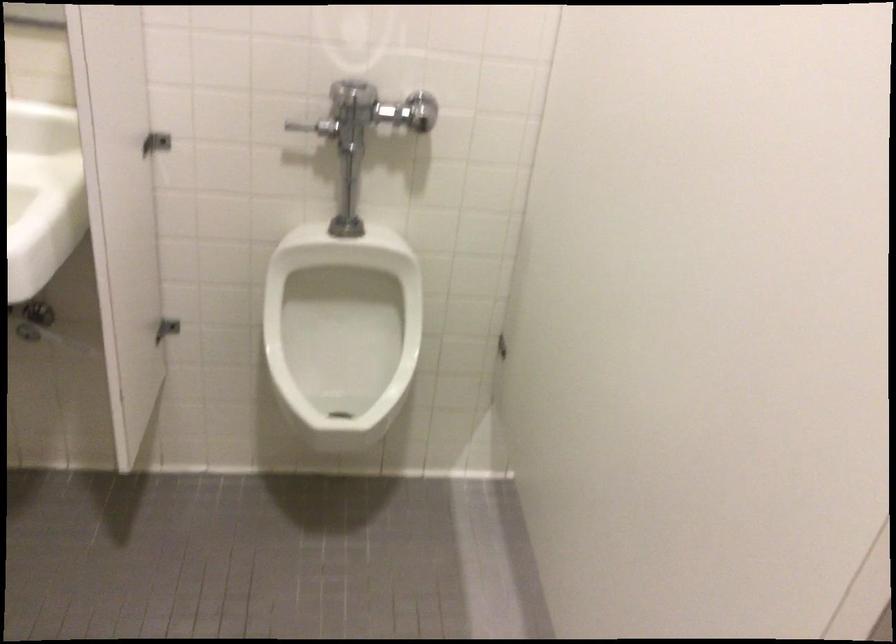
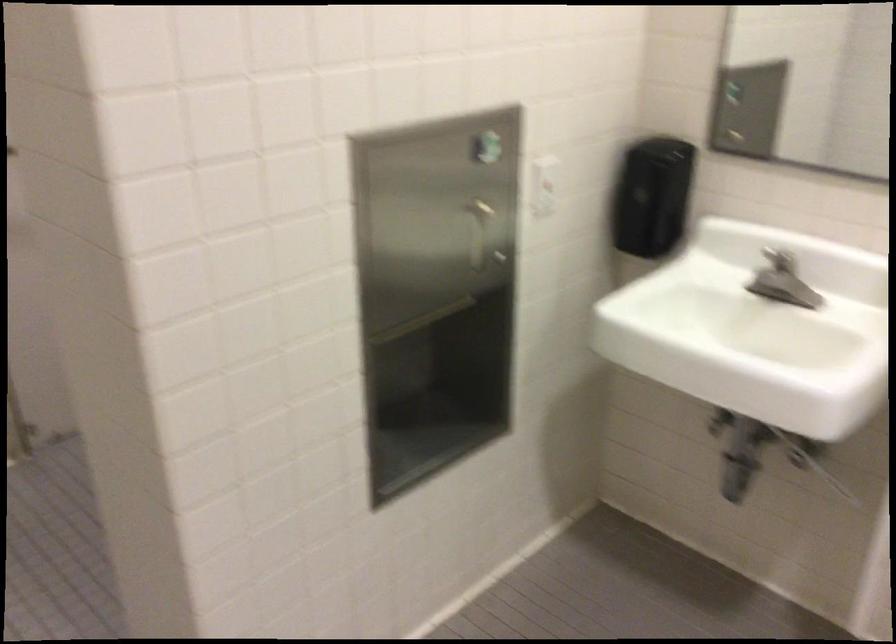
Question: Based on the continuous images, in which direction is the camera rotating? Reply with the corresponding letter.

Choices:
 (A) Left
 (B) Right
 (C) Up
 (D) Down

Answer: (A)